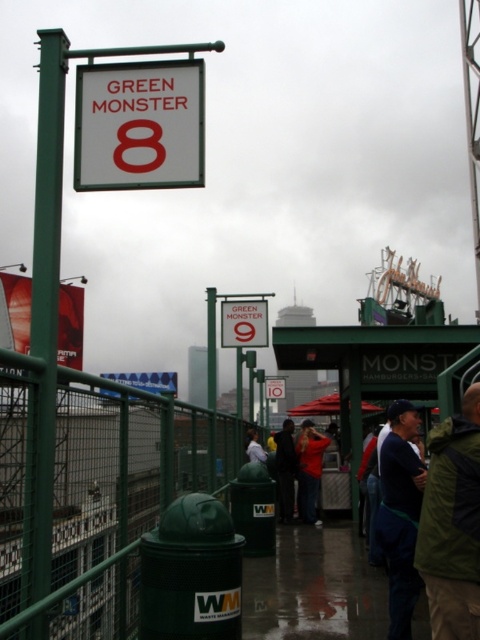
You are a spectator at the baseball game and notice two coats hanging on the fence near the Green Monster sign. The coats are labeled as the red jacket at center and the dark fabric coat at center. Which coat has a shorter length?

The red jacket at center is shorter than the dark fabric coat at center.

You are a maintenance worker at the stadium and need to replace the signs. The white plastic sign at upper center and the green plastic sign at upper center are both mounted on poles. Which sign has a narrower width?

The white plastic sign at upper center is thinner than the green plastic sign at upper center, so the white plastic sign at upper center has a narrower width.